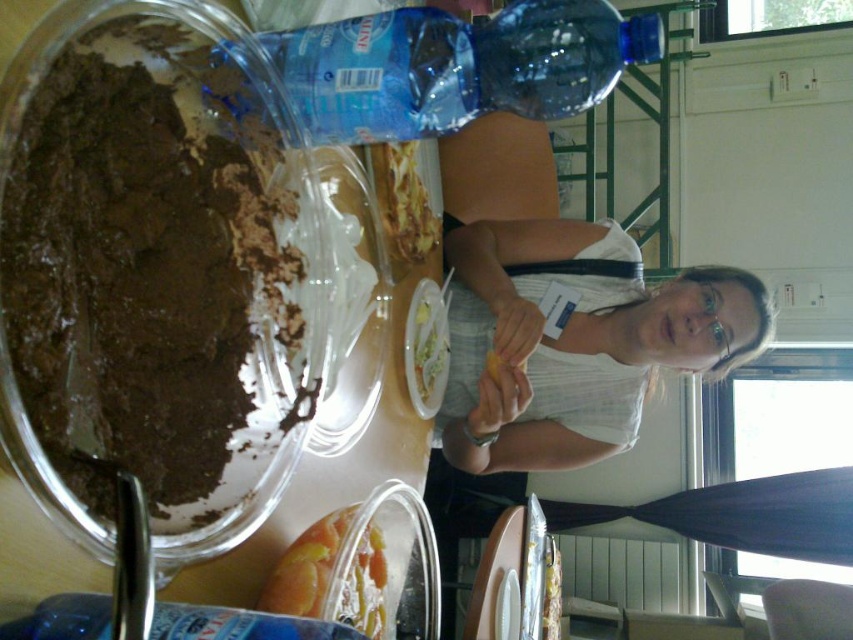
Between dark matte chocolate cake at left and blue plastic bottle at lower left, which one has less height?

blue plastic bottle at lower left is shorter.

Which is below, dark matte chocolate cake at left or blue plastic bottle at lower left?

Positioned lower is blue plastic bottle at lower left.

Where is `dark matte chocolate cake at left`? This screenshot has height=640, width=853. dark matte chocolate cake at left is located at coordinates (152, 288).

What are the coordinates of `dark matte chocolate cake at left` in the screenshot? It's located at (152, 288).

I want to click on transparent plastic bottle at upper center, so click(456, 67).

Which is behind, point (578, 17) or point (701, 284)?

The point (701, 284) is behind.

Measure the distance between point (x=503, y=22) and camera.

29.61 inches

At what (x,y) coordinates should I click in order to perform the action: click on transparent plastic bottle at upper center. Please return your answer as a coordinate pair (x, y). This screenshot has height=640, width=853. Looking at the image, I should click on (x=456, y=67).

Between blue plastic bottle at lower left and translucent plastic container at lower center, which one appears on the right side from the viewer's perspective?

translucent plastic container at lower center

Which is above, blue plastic bottle at lower left or translucent plastic container at lower center?

blue plastic bottle at lower left is above.

Between point (88, 596) and point (287, 561), which one is positioned in front?

Point (88, 596)

I want to click on blue plastic bottle at lower left, so click(239, 625).